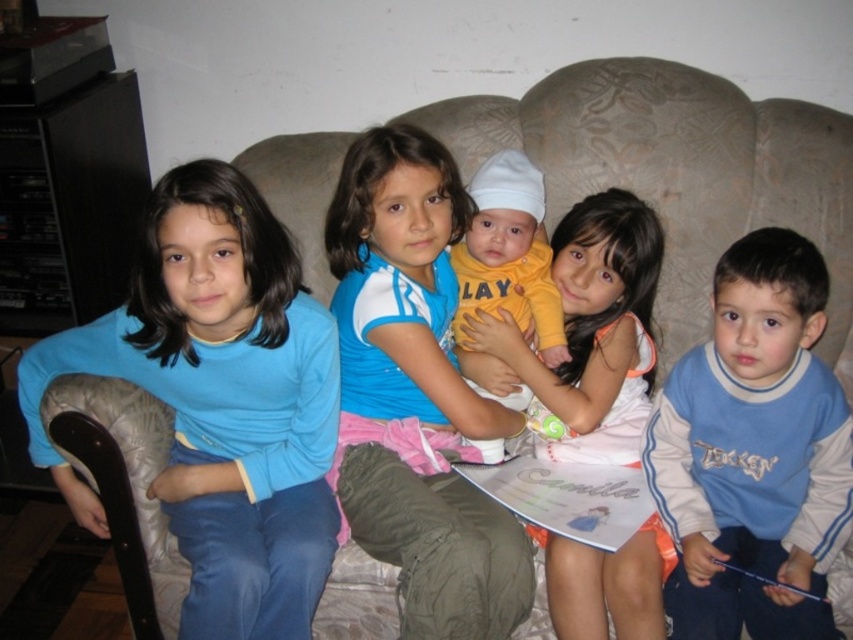
At what (x,y) coordinates should I click in order to perform the action: click on matte blue shirt at center. Please return your answer as a coordinate pair (x, y). Looking at the image, I should click on 416,394.

The image size is (853, 640). What do you see at coordinates (416, 394) in the screenshot?
I see `matte blue shirt at center` at bounding box center [416, 394].

Where is `matte blue shirt at center`? This screenshot has width=853, height=640. matte blue shirt at center is located at coordinates (416, 394).

Identify the location of blue cotton shirt at left. The height and width of the screenshot is (640, 853). [x=219, y=403].

Does point (35, 445) lie in front of point (805, 352)?

No.

Where is `blue cotton shirt at left`? The image size is (853, 640). blue cotton shirt at left is located at coordinates (219, 403).

Between blue cotton shirt at left and matte blue shirt at center, which one appears on the left side from the viewer's perspective?

blue cotton shirt at left

Can you confirm if blue cotton shirt at left is wider than matte blue shirt at center?

Yes.

This screenshot has height=640, width=853. In order to click on blue cotton shirt at left in this screenshot , I will do `click(219, 403)`.

Where is `blue cotton shirt at left`? blue cotton shirt at left is located at coordinates (219, 403).